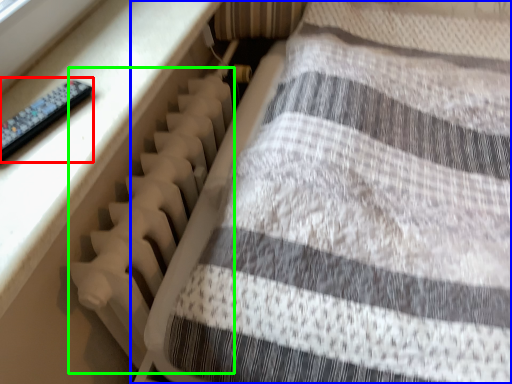
Question: Based on their relative distances, which object is farther from control (highlighted by a red box)? Choose from furniture (highlighted by a blue box) and radiator (highlighted by a green box).

Choices:
 (A) furniture
 (B) radiator

Answer: (A)